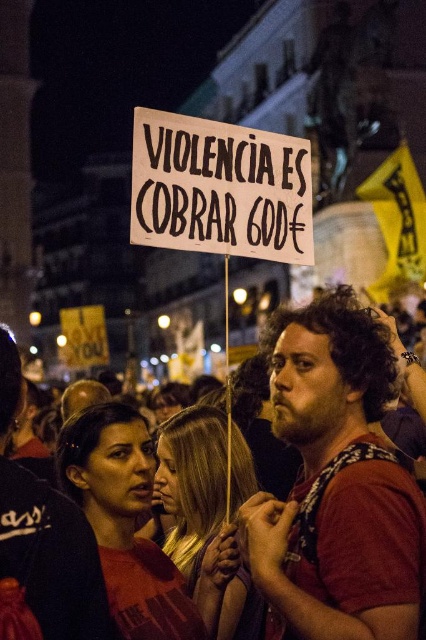
Question: Estimate the real-world distances between objects in this image. Which object is farther from the red shirt at center?

Choices:
 (A) white paper sign at center
 (B) dark red t-shirt at center

Answer: (A)

Question: Which is farther from the white paper sign at center?

Choices:
 (A) dark red t-shirt at center
 (B) red shirt at center

Answer: (B)

Question: Observing the image, what is the correct spatial positioning of dark red t-shirt at center in reference to white paper sign at center?

Choices:
 (A) above
 (B) below

Answer: (B)

Question: Is dark red t-shirt at center behind white paper sign at center?

Choices:
 (A) yes
 (B) no

Answer: (B)

Question: Among these objects, which one is nearest to the camera?

Choices:
 (A) dark red t-shirt at center
 (B) red shirt at center
 (C) white paper sign at center

Answer: (B)

Question: Does red shirt at center come in front of white paper sign at center?

Choices:
 (A) yes
 (B) no

Answer: (A)